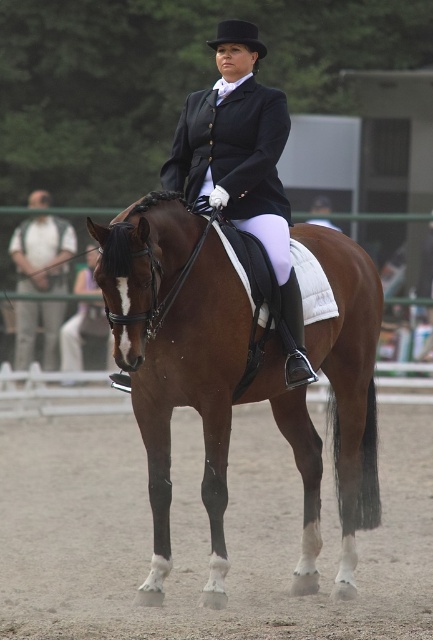
You are a photographer at a horse show. You need to capture a photo of the brown glossy horse at center standing on the brown sandy dirt at center. Based on the description, will the horse be entirely visible on the dirt in the photo?

The brown glossy horse at center is wider than the brown sandy dirt at center, so the horse will not be entirely visible on the dirt in the photo.